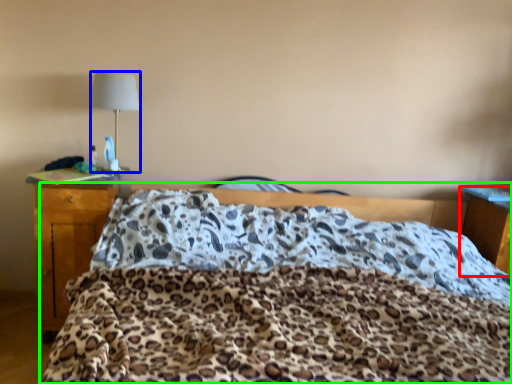
Question: Estimate the real-world distances between objects in this image. Which object is closer to nightstand (highlighted by a red box), lamp (highlighted by a blue box) or bed (highlighted by a green box)?

Choices:
 (A) lamp
 (B) bed

Answer: (B)